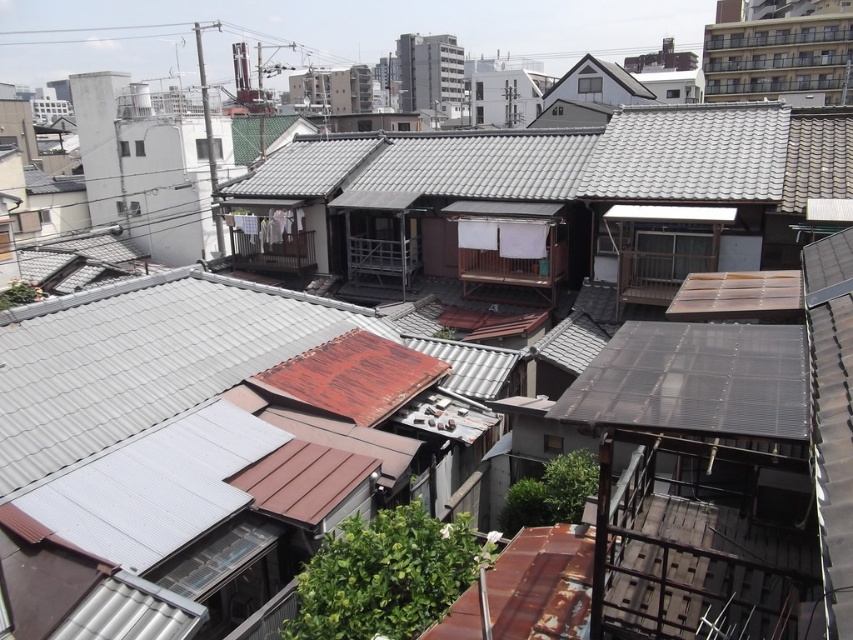
Question: Which point is farther from the camera taking this photo?

Choices:
 (A) tap(625, 369)
 (B) tap(785, 168)

Answer: (B)

Question: Does gray tile roof at center lie behind transparent plastic roof at center-right?

Choices:
 (A) no
 (B) yes

Answer: (B)

Question: Which point appears farthest from the camera in this image?

Choices:
 (A) (556, 170)
 (B) (767, 413)

Answer: (A)

Question: Does gray tile roof at center have a greater width compared to transparent plastic roof at center-right?

Choices:
 (A) yes
 (B) no

Answer: (A)

Question: Does gray tile roof at center appear over transparent plastic roof at center-right?

Choices:
 (A) no
 (B) yes

Answer: (B)